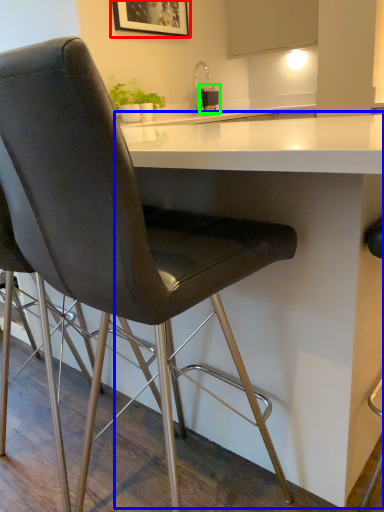
Question: Which is farther away from picture frame (highlighted by a red box)? table (highlighted by a blue box) or appliance (highlighted by a green box)?

Choices:
 (A) table
 (B) appliance

Answer: (A)